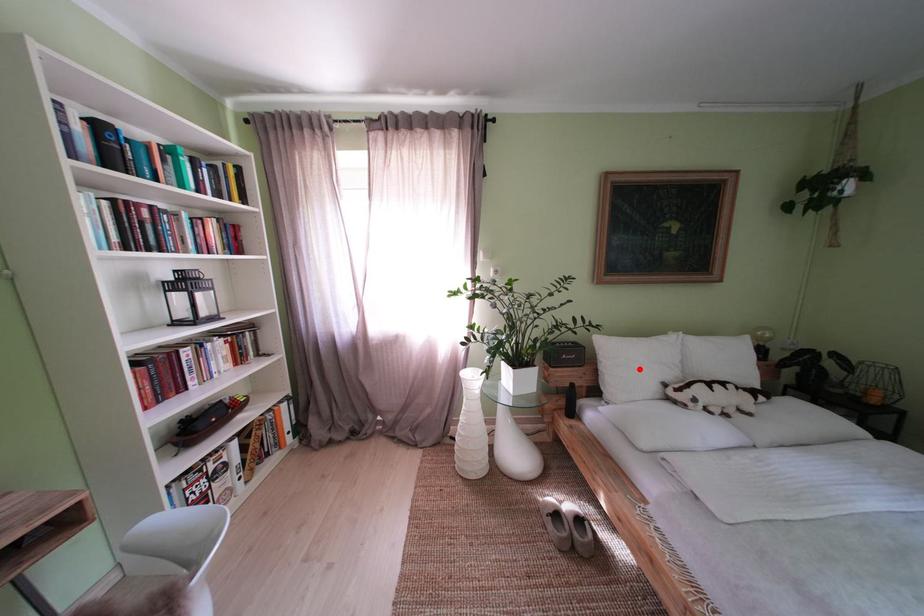
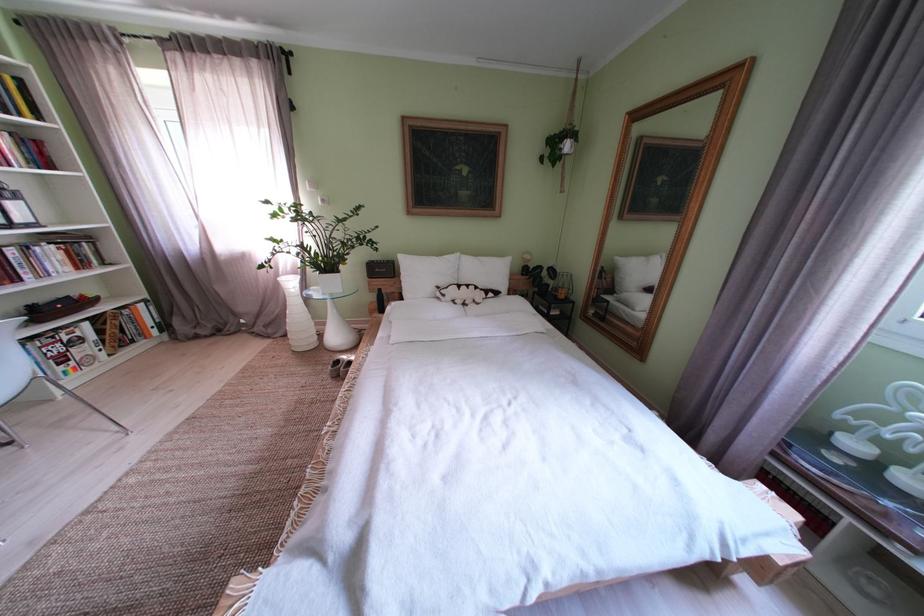
The point at the highlighted location is marked in the first image. Where is the corresponding point in the second image?

(429, 280)